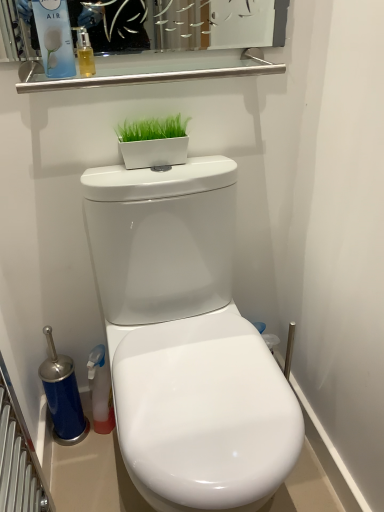
Question: Can you confirm if satin nickel bar at upper center is positioned to the left of translucent amber liquid at upper left?

Choices:
 (A) no
 (B) yes

Answer: (A)

Question: Is satin nickel bar at upper center with translucent amber liquid at upper left?

Choices:
 (A) no
 (B) yes

Answer: (A)

Question: From a real-world perspective, is satin nickel bar at upper center located beneath translucent amber liquid at upper left?

Choices:
 (A) yes
 (B) no

Answer: (A)

Question: Considering the relative sizes of satin nickel bar at upper center and translucent amber liquid at upper left in the image provided, is satin nickel bar at upper center wider than translucent amber liquid at upper left?

Choices:
 (A) yes
 (B) no

Answer: (A)

Question: Is satin nickel bar at upper center outside of translucent amber liquid at upper left?

Choices:
 (A) yes
 (B) no

Answer: (A)

Question: Would you consider satin nickel bar at upper center to be distant from translucent amber liquid at upper left?

Choices:
 (A) yes
 (B) no

Answer: (B)

Question: From a real-world perspective, is white glossy flowerpot at upper center positioned over satin nickel bar at upper center based on gravity?

Choices:
 (A) no
 (B) yes

Answer: (A)

Question: From a real-world perspective, is white glossy flowerpot at upper center physically below satin nickel bar at upper center?

Choices:
 (A) yes
 (B) no

Answer: (A)

Question: Considering the relative sizes of white glossy flowerpot at upper center and satin nickel bar at upper center in the image provided, is white glossy flowerpot at upper center bigger than satin nickel bar at upper center?

Choices:
 (A) no
 (B) yes

Answer: (A)

Question: Does white glossy flowerpot at upper center turn towards satin nickel bar at upper center?

Choices:
 (A) no
 (B) yes

Answer: (A)

Question: Does white glossy flowerpot at upper center come behind satin nickel bar at upper center?

Choices:
 (A) no
 (B) yes

Answer: (B)

Question: Considering the relative sizes of white glossy flowerpot at upper center and satin nickel bar at upper center in the image provided, is white glossy flowerpot at upper center shorter than satin nickel bar at upper center?

Choices:
 (A) yes
 (B) no

Answer: (B)

Question: Is matte blue air freshener at upper left taller than translucent amber liquid at upper left?

Choices:
 (A) yes
 (B) no

Answer: (A)